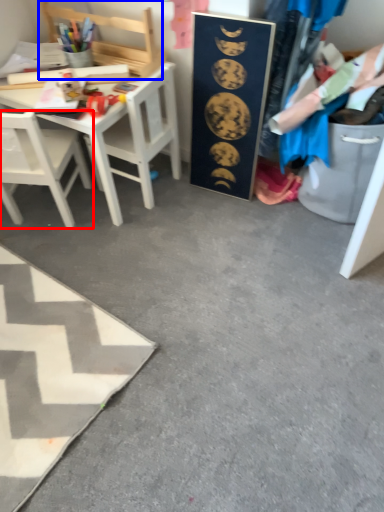
Question: Which object appears farthest to the camera in this image, chair (highlighted by a red box) or chair (highlighted by a blue box)?

Choices:
 (A) chair
 (B) chair

Answer: (B)